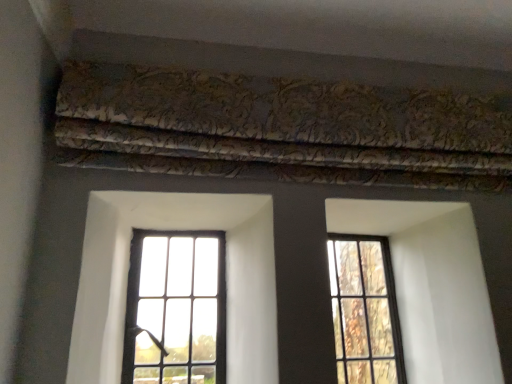
Question: From a real-world perspective, is clear glass window at right, acting as the 2th window starting from the left, physically below clear glass window at center, placed as the 2th window when sorted from right to left?

Choices:
 (A) yes
 (B) no

Answer: (A)

Question: Does clear glass window at right, the first window when ordered from right to left, lie behind clear glass window at center, which is counted as the 1th window, starting from the left?

Choices:
 (A) no
 (B) yes

Answer: (B)

Question: From a real-world perspective, is clear glass window at right, acting as the 2th window starting from the left, located higher than clear glass window at center, which is counted as the 1th window, starting from the left?

Choices:
 (A) no
 (B) yes

Answer: (A)

Question: Does clear glass window at right, the first window when ordered from right to left, have a lesser height compared to clear glass window at center, placed as the 2th window when sorted from right to left?

Choices:
 (A) no
 (B) yes

Answer: (A)

Question: Could you tell me if clear glass window at right, acting as the 2th window starting from the left, is turned towards clear glass window at center, which is counted as the 1th window, starting from the left?

Choices:
 (A) no
 (B) yes

Answer: (A)

Question: Can you confirm if clear glass window at right, the first window when ordered from right to left, is smaller than clear glass window at center, placed as the 2th window when sorted from right to left?

Choices:
 (A) yes
 (B) no

Answer: (A)

Question: Is clear glass window at center, placed as the 2th window when sorted from right to left, taller than gold-patterned fabric at upper center?

Choices:
 (A) no
 (B) yes

Answer: (B)

Question: Considering the relative sizes of clear glass window at center, which is counted as the 1th window, starting from the left, and gold-patterned fabric at upper center in the image provided, is clear glass window at center, which is counted as the 1th window, starting from the left, shorter than gold-patterned fabric at upper center?

Choices:
 (A) yes
 (B) no

Answer: (B)

Question: Is clear glass window at center, placed as the 2th window when sorted from right to left, positioned with its back to gold-patterned fabric at upper center?

Choices:
 (A) no
 (B) yes

Answer: (A)

Question: Is the position of clear glass window at center, which is counted as the 1th window, starting from the left, more distant than that of gold-patterned fabric at upper center?

Choices:
 (A) no
 (B) yes

Answer: (B)

Question: Is gold-patterned fabric at upper center surrounded by clear glass window at center, which is counted as the 1th window, starting from the left?

Choices:
 (A) yes
 (B) no

Answer: (B)

Question: Does clear glass window at center, placed as the 2th window when sorted from right to left, turn towards gold-patterned fabric at upper center?

Choices:
 (A) yes
 (B) no

Answer: (B)

Question: Is clear glass window at center, placed as the 2th window when sorted from right to left, oriented away from clear glass window at right, the first window when ordered from right to left?

Choices:
 (A) yes
 (B) no

Answer: (B)